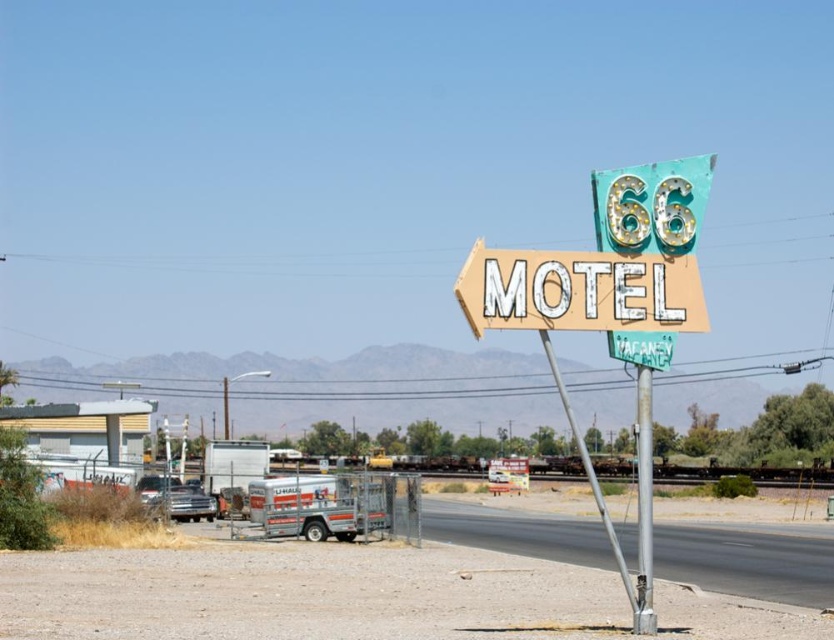
Measure the distance from metallic pole at center to green neon motel sign at center.

They are 97.28 centimeters apart.

Which is in front, point (639, 493) or point (666, 337)?

Point (639, 493) is in front.

Locate an element on the screen. metallic pole at center is located at coordinates (642, 504).

Is vintage neon motel sign at center taller than green neon motel sign at center?

Yes, vintage neon motel sign at center is taller than green neon motel sign at center.

Identify the location of vintage neon motel sign at center. This screenshot has height=640, width=834. (579, 291).

Where is `vintage neon motel sign at center`? This screenshot has height=640, width=834. vintage neon motel sign at center is located at coordinates (579, 291).

Which is below, vintage neon motel sign at center or metallic pole at center?

metallic pole at center

Consider the image. Does vintage neon motel sign at center appear under metallic pole at center?

No.

Find the location of a particular element. vintage neon motel sign at center is located at coordinates (579, 291).

Locate an element on the screen. vintage neon motel sign at center is located at coordinates (579, 291).